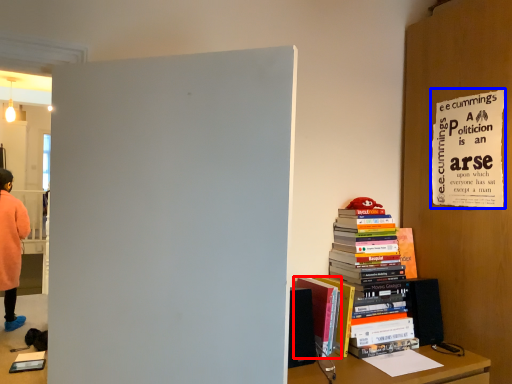
Question: Among these objects, which one is farthest to the camera, book (highlighted by a red box) or poster page (highlighted by a blue box)?

Choices:
 (A) book
 (B) poster page

Answer: (A)